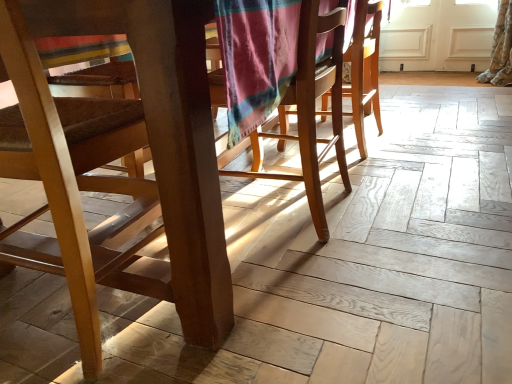
Question: Choose the correct answer: Is wooden chair at left, marked as the 1th chair in a left-to-right arrangement, inside wooden chair at center, the 2th chair in the left-to-right sequence, or outside it?

Choices:
 (A) inside
 (B) outside

Answer: (B)

Question: In terms of width, does wooden chair at left, marked as the 1th chair in a left-to-right arrangement, look wider or thinner when compared to wooden chair at center, the 2th chair in the left-to-right sequence?

Choices:
 (A) wide
 (B) thin

Answer: (A)

Question: Is wooden chair at left, marked as the 1th chair in a left-to-right arrangement, in front of or behind wooden chair at center, the 2th chair in the left-to-right sequence, in the image?

Choices:
 (A) behind
 (B) front

Answer: (B)

Question: From the image's perspective, relative to wooden chair at left, marked as the 1th chair in a left-to-right arrangement, is wooden chair at center, which is the 1th chair from right to left, above or below?

Choices:
 (A) above
 (B) below

Answer: (A)

Question: From a real-world perspective, is wooden chair at center, the 2th chair in the left-to-right sequence, physically located above or below wooden chair at left, which is the 2th chair in right-to-left order?

Choices:
 (A) above
 (B) below

Answer: (B)

Question: Is wooden chair at center, which is the 1th chair from right to left, wider or thinner than wooden chair at left, marked as the 1th chair in a left-to-right arrangement?

Choices:
 (A) thin
 (B) wide

Answer: (A)

Question: Visually, is wooden chair at center, which is the 1th chair from right to left, positioned to the left or to the right of wooden chair at left, which is the 2th chair in right-to-left order?

Choices:
 (A) right
 (B) left

Answer: (A)